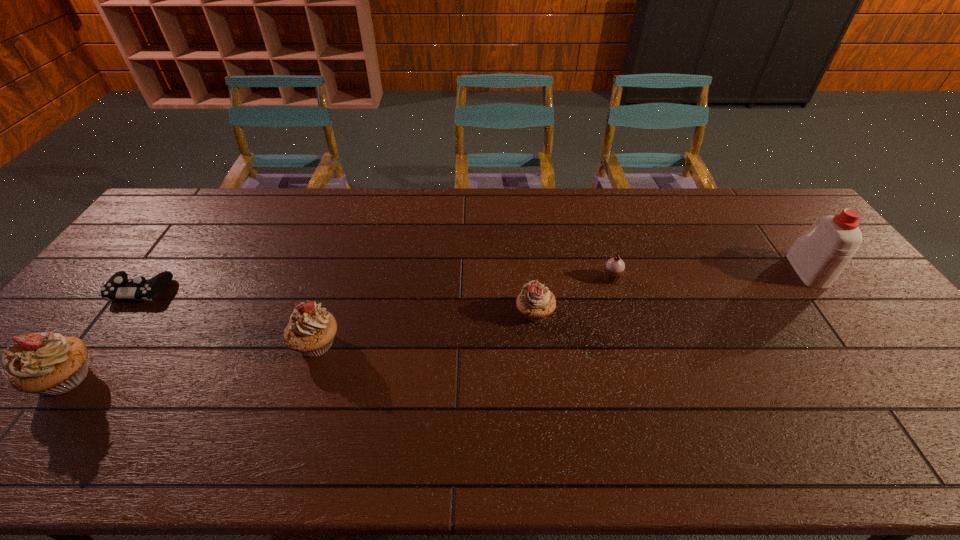
I want to click on control located in the left edge section of the desktop, so click(x=118, y=286).

Where is `object that is at the right edge`? object that is at the right edge is located at coordinates (818, 257).

Where is `object present at the near left corner`? object present at the near left corner is located at coordinates (50, 364).

The height and width of the screenshot is (540, 960). In the image, there is a desktop. What are the coordinates of `free space at the far edge` in the screenshot? It's located at (676, 213).

Locate an element on the screen. vacant area at the near edge is located at coordinates (604, 413).

What are the coordinates of `free location at the left edge` in the screenshot? It's located at (133, 268).

This screenshot has width=960, height=540. Identify the location of vacant space that is in between the shortest object and the leftmost cupcake. (104, 334).

At what (x,y) coordinates should I click in order to perform the action: click on empty location between the detergent and the shortest cupcake. Please return your answer as a coordinate pair (x, y). This screenshot has height=540, width=960. Looking at the image, I should click on 709,275.

Identify the location of free space between the third tallest object and the second shortest object. click(464, 311).

I want to click on free space between the shortest object and the leftmost cupcake, so click(x=104, y=334).